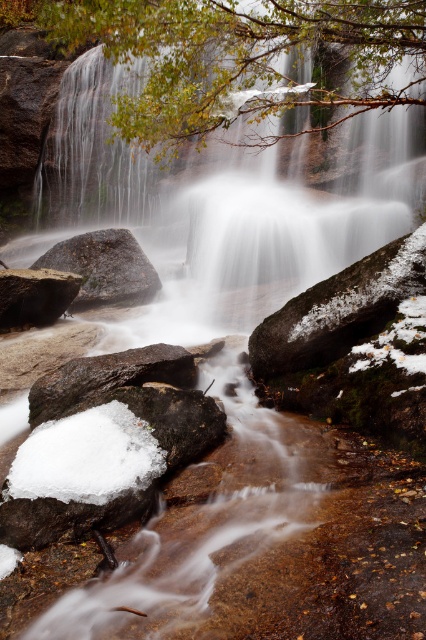
Question: Can you confirm if snowy mossy rock at center is bigger than rusty metallic rock at center-left?

Choices:
 (A) yes
 (B) no

Answer: (A)

Question: Which point is closer to the camera taking this photo?

Choices:
 (A) (124, 368)
 (B) (117, 460)
 (C) (340, 301)
 (D) (85, 273)

Answer: (B)

Question: Can you confirm if white fluffy snow at lower left is positioned below matte black rock at lower left?

Choices:
 (A) no
 (B) yes

Answer: (B)

Question: Which of these objects is positioned closest to the snowy mossy rock at center?

Choices:
 (A) green leafy branch at upper center
 (B) white fluffy snow at lower left

Answer: (B)

Question: Considering the relative positions of rusty metallic rock at center-left and matte black rock at lower left in the image provided, where is rusty metallic rock at center-left located with respect to matte black rock at lower left?

Choices:
 (A) left
 (B) right

Answer: (B)

Question: Among these objects, which one is nearest to the camera?

Choices:
 (A) green leafy branch at upper center
 (B) gray matte rock at center
 (C) white fluffy snow at lower left

Answer: (C)